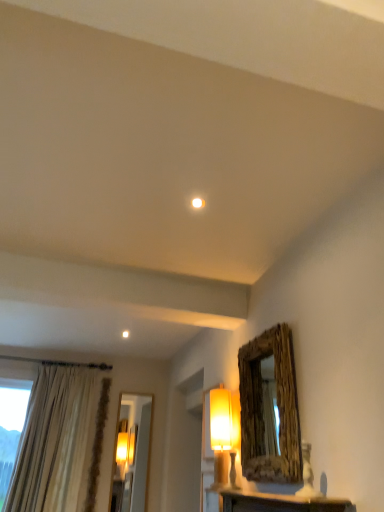
Question: From the image's perspective, does wooden frame mirror at upper right appear higher than matte yellow fabric lampshade at center-right?

Choices:
 (A) yes
 (B) no

Answer: (A)

Question: Would you say wooden frame mirror at upper right is a long distance from matte yellow fabric lampshade at center-right?

Choices:
 (A) yes
 (B) no

Answer: (B)

Question: Can you confirm if wooden frame mirror at upper right is thinner than matte yellow fabric lampshade at center-right?

Choices:
 (A) no
 (B) yes

Answer: (B)

Question: From a real-world perspective, is wooden frame mirror at upper right located higher than matte yellow fabric lampshade at center-right?

Choices:
 (A) no
 (B) yes

Answer: (B)

Question: Could matte yellow fabric lampshade at center-right be considered to be inside wooden frame mirror at upper right?

Choices:
 (A) yes
 (B) no

Answer: (B)

Question: From a real-world perspective, is matte yellow fabric lampshade at center-right positioned above or below white marble table at lower center?

Choices:
 (A) above
 (B) below

Answer: (A)

Question: Is matte yellow fabric lampshade at center-right bigger or smaller than white marble table at lower center?

Choices:
 (A) big
 (B) small

Answer: (A)

Question: From the image's perspective, is matte yellow fabric lampshade at center-right positioned above or below white marble table at lower center?

Choices:
 (A) above
 (B) below

Answer: (A)

Question: Relative to white marble table at lower center, is matte yellow fabric lampshade at center-right in front or behind?

Choices:
 (A) behind
 (B) front

Answer: (A)

Question: In terms of size, does matte yellow fabric lampshade at center-right appear bigger or smaller than white glossy light bulb at center?

Choices:
 (A) small
 (B) big

Answer: (B)

Question: Would you say matte yellow fabric lampshade at center-right is to the left or to the right of white glossy light bulb at center in the picture?

Choices:
 (A) left
 (B) right

Answer: (B)

Question: In terms of height, does matte yellow fabric lampshade at center-right look taller or shorter compared to white glossy light bulb at center?

Choices:
 (A) short
 (B) tall

Answer: (B)

Question: Does point (213, 467) appear closer or farther from the camera than point (195, 199)?

Choices:
 (A) farther
 (B) closer

Answer: (A)

Question: From the image's perspective, is wooden frame mirror at upper right positioned above or below white glossy light bulb at center?

Choices:
 (A) above
 (B) below

Answer: (B)

Question: From a real-world perspective, relative to white glossy light bulb at center, is wooden frame mirror at upper right vertically above or below?

Choices:
 (A) below
 (B) above

Answer: (A)